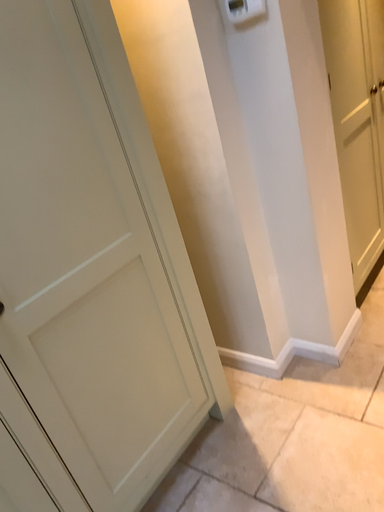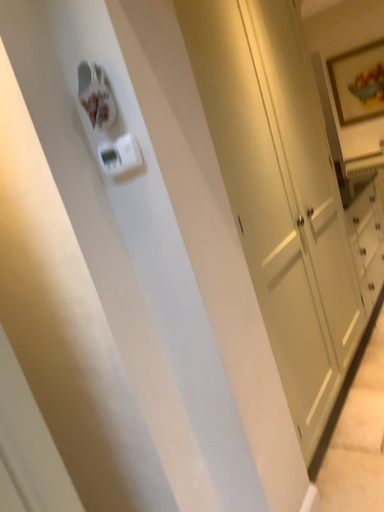
Question: Which way did the camera rotate in the video?

Choices:
 (A) rotated upward
 (B) rotated downward

Answer: (A)